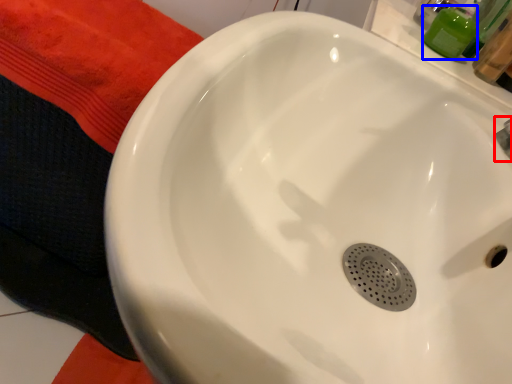
Question: Which object appears farthest to the camera in this image, plumbing fixture (highlighted by a red box) or toiletry (highlighted by a blue box)?

Choices:
 (A) plumbing fixture
 (B) toiletry

Answer: (B)